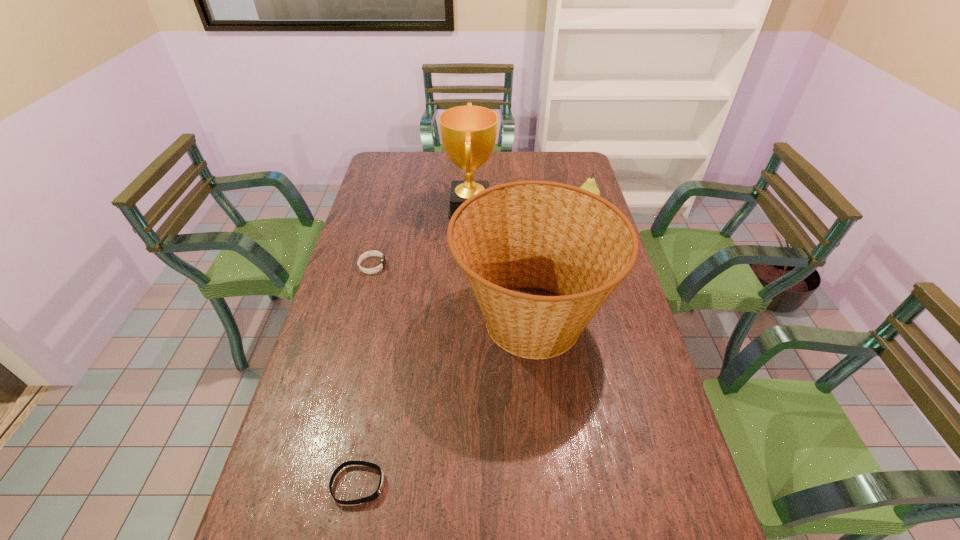
Find the location of a particular element. This screenshot has height=540, width=960. object that stands as the closest to the basket is located at coordinates (468, 133).

Where is `object that ranks as the second closest to the second shortest object`? Image resolution: width=960 pixels, height=540 pixels. object that ranks as the second closest to the second shortest object is located at coordinates (528, 234).

Locate an element on the screen. wristband that can be found as the closest to the basket is located at coordinates (369, 253).

Find the location of a particular element. the second closest wristband relative to the award is located at coordinates (381, 484).

Locate an element on the screen. The height and width of the screenshot is (540, 960). vacant space that satisfies the following two spatial constraints: 1. on the back side of the basket; 2. on the front-facing side of the award is located at coordinates (519, 207).

Identify the location of free space that satisfies the following two spatial constraints: 1. on the front side of the third tallest object; 2. on the outer surface of the taller wristband. (606, 266).

You are a GUI agent. You are given a task and a screenshot of the screen. Output one action in this format:
    pyautogui.click(x=<x>, y=<y>)
    Task: Click on the vacant point that satisfies the following two spatial constraints: 1. on the front-facing side of the basket; 2. on the left side of the award
    This screenshot has height=540, width=960.
    Given the screenshot: What is the action you would take?
    pyautogui.click(x=468, y=319)

At what (x,y) coordinates should I click in order to perform the action: click on vacant region that satisfies the following two spatial constraints: 1. on the front side of the third shortest object; 2. on the outer surface of the second shortest object. Please return your answer as a coordinate pair (x, y). The width and height of the screenshot is (960, 540). Looking at the image, I should click on (606, 266).